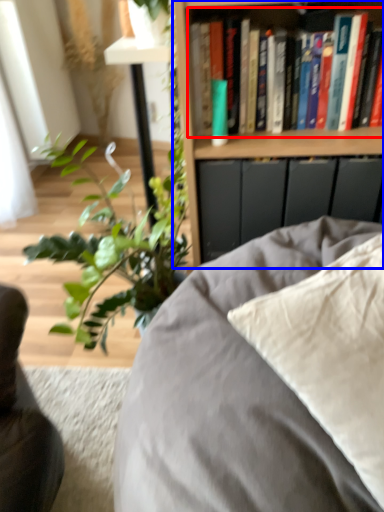
Question: Among these objects, which one is nearest to the camera, book (highlighted by a red box) or bookcase (highlighted by a blue box)?

Choices:
 (A) book
 (B) bookcase

Answer: (B)